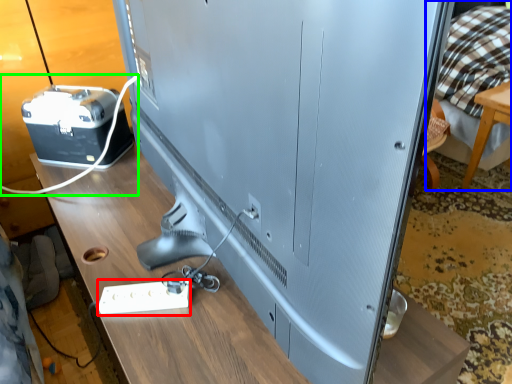
Question: Which object is positioned farthest from extension cord (highlighted by a red box)? Select from bed (highlighted by a blue box) and wire (highlighted by a green box).

Choices:
 (A) bed
 (B) wire

Answer: (A)